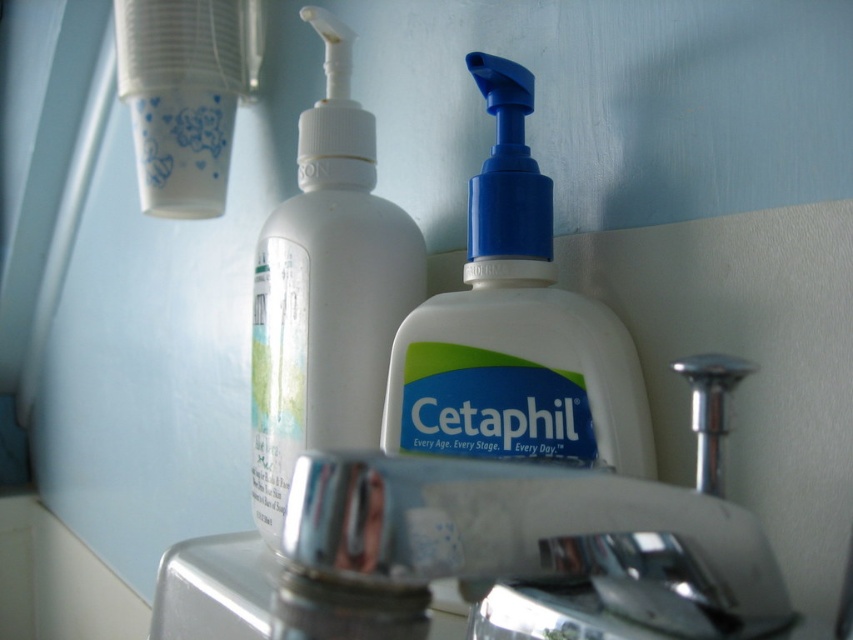
You are trying to decide whether to place a new toothbrush holder between the silver metallic faucet at center and the white plastic bottle at center. Given their widths, will the toothbrush holder fit if it requires 10 cm of space?

The silver metallic faucet at center is wider than the white plastic bottle at center, but without knowing their exact widths, it is impossible to determine if there is enough space for the toothbrush holder requiring 10 cm. Additional measurements are needed.

You are trying to reach for the white plastic bottle at center in the bathroom sink area. Which direction should you move your hand relative to the silver metallic faucet at center to grab it?

To reach the white plastic bottle at center, move your hand to the left of the silver metallic faucet at center since the white plastic bottle at center is located to the left of the faucet.